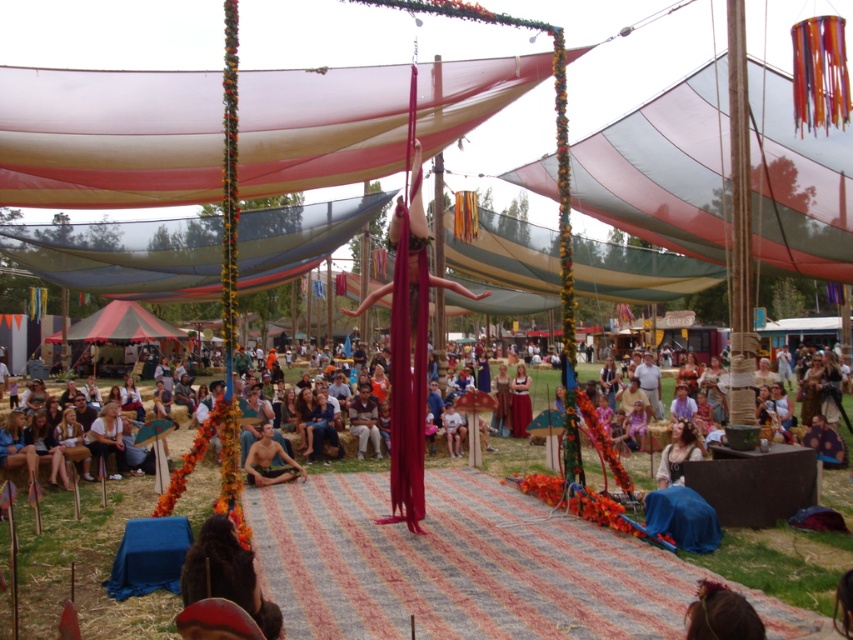
Question: Which of the following is the farthest from the observer?

Choices:
 (A) (245, 468)
 (B) (662, 477)
 (C) (676, 122)
 (D) (515, 458)

Answer: (C)

Question: Which is farther from the brown leather purse at center?

Choices:
 (A) smooth skin person at center
 (B) shiny metallic meditating person at center

Answer: (A)

Question: Which point is closer to the camera?

Choices:
 (A) (252, 461)
 (B) (665, 484)
 (C) (747, 84)
 (D) (178, 449)

Answer: (B)

Question: Can you confirm if smooth skin person at center is positioned to the right of brown leather purse at center?

Choices:
 (A) yes
 (B) no

Answer: (B)

Question: Does red fabric canopy at upper center have a lesser width compared to brown leather purse at center?

Choices:
 (A) no
 (B) yes

Answer: (A)

Question: Is smooth skin person at center smaller than brown leather purse at center?

Choices:
 (A) yes
 (B) no

Answer: (B)